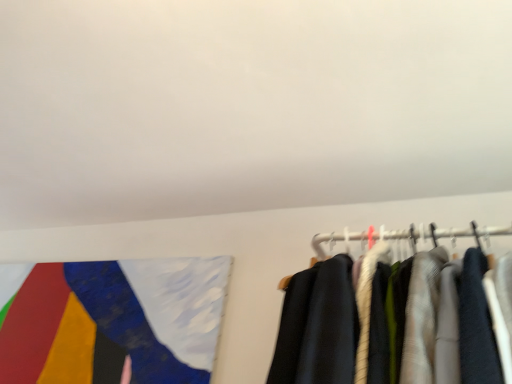
Question: Relative to painted fabric flag at upper left, is white matte wall at upper center in front or behind?

Choices:
 (A) behind
 (B) front

Answer: (B)

Question: From a real-world perspective, is white matte wall at upper center physically located above or below painted fabric flag at upper left?

Choices:
 (A) below
 (B) above

Answer: (B)

Question: Is white matte wall at upper center bigger or smaller than painted fabric flag at upper left?

Choices:
 (A) big
 (B) small

Answer: (A)

Question: Considering the relative positions of painted fabric flag at upper left and white matte wall at upper center in the image provided, is painted fabric flag at upper left to the left or to the right of white matte wall at upper center?

Choices:
 (A) right
 (B) left

Answer: (B)

Question: Looking at the image, does painted fabric flag at upper left seem bigger or smaller compared to white matte wall at upper center?

Choices:
 (A) big
 (B) small

Answer: (B)

Question: Considering the positions of painted fabric flag at upper left and white matte wall at upper center in the image, is painted fabric flag at upper left wider or thinner than white matte wall at upper center?

Choices:
 (A) thin
 (B) wide

Answer: (A)

Question: From a real-world perspective, is painted fabric flag at upper left above or below white matte wall at upper center?

Choices:
 (A) below
 (B) above

Answer: (A)